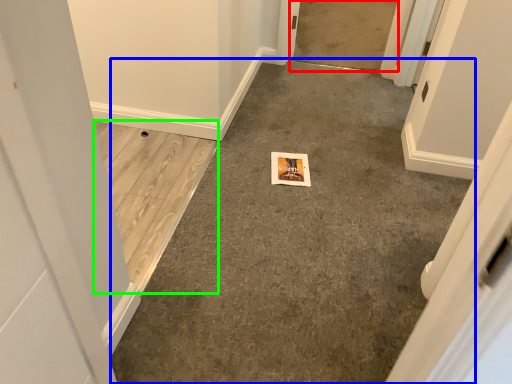
Question: Based on their relative distances, which object is farther from concrete (highlighted by a red box)? Choose from concrete (highlighted by a blue box) and concrete (highlighted by a green box).

Choices:
 (A) concrete
 (B) concrete

Answer: (B)